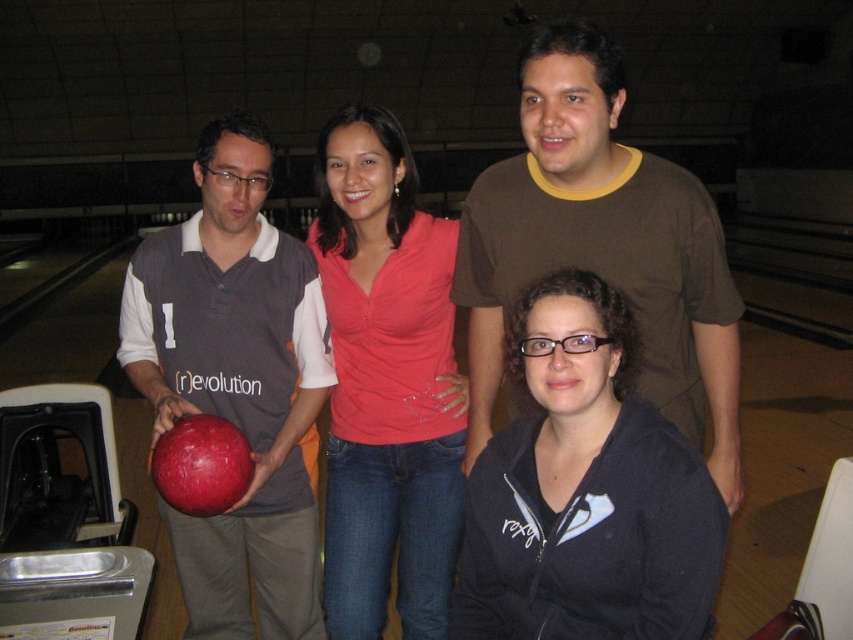
Question: Among these points, which one is farthest from the camera?

Choices:
 (A) (589, 563)
 (B) (241, 481)
 (C) (651, 195)
 (D) (341, 124)

Answer: (D)

Question: Is matte pink shirt at center smaller than rubberized red bowling ball at center?

Choices:
 (A) no
 (B) yes

Answer: (A)

Question: Does matte pink shirt at center have a larger size compared to rubberized red bowling ball at center?

Choices:
 (A) no
 (B) yes

Answer: (B)

Question: Which point appears farthest from the camera in this image?

Choices:
 (A) (331, 296)
 (B) (281, 460)

Answer: (A)

Question: Among these objects, which one is nearest to the camera?

Choices:
 (A) matte pink shirt at center
 (B) black matte jacket at lower right
 (C) rubberized red bowling ball at center

Answer: (B)

Question: Can you confirm if brown cotton t-shirt at upper center is positioned above rubberized red bowling ball at center?

Choices:
 (A) no
 (B) yes

Answer: (B)